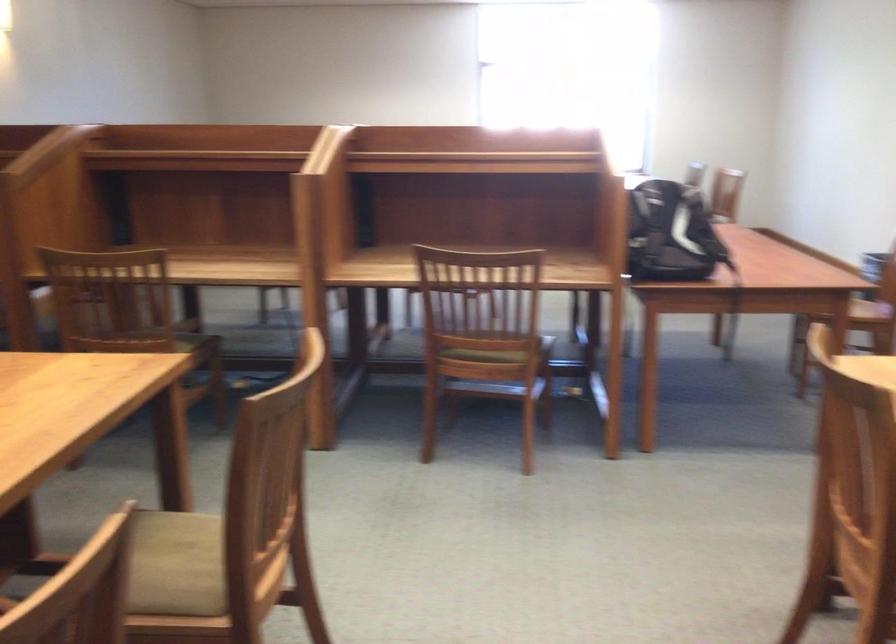
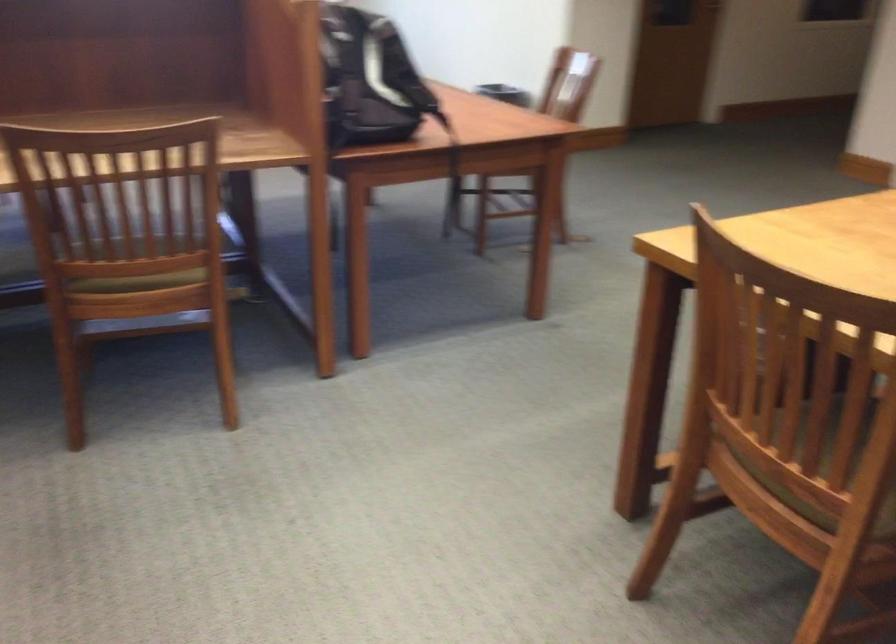
The point at (480, 343) is marked in the first image. Where is the corresponding point in the second image?

(139, 266)